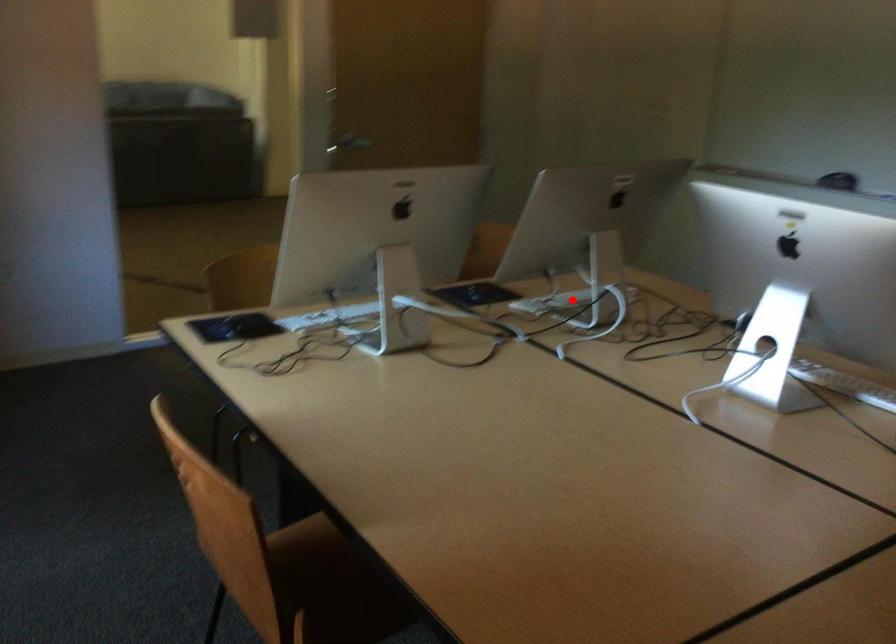
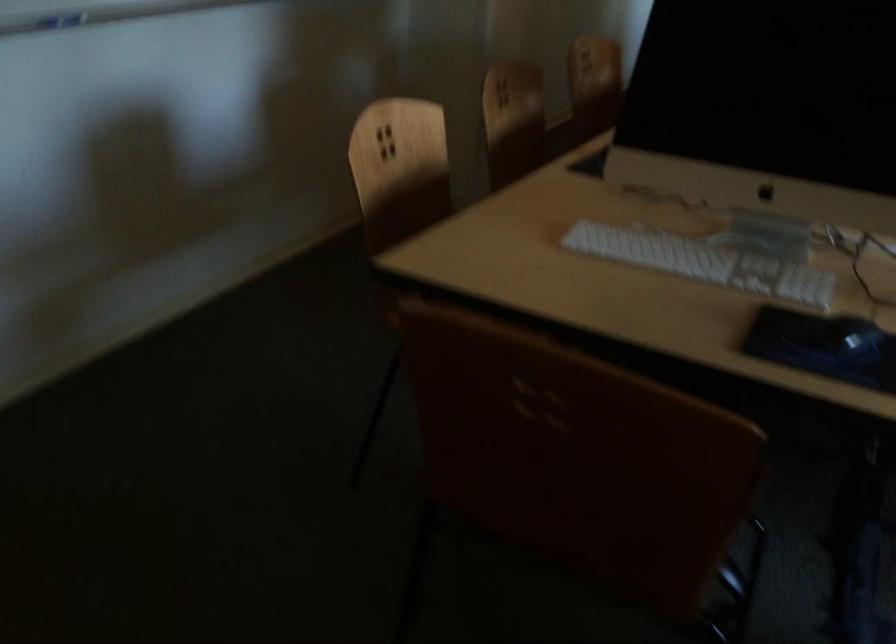
Question: I am providing you with two images of the same scene from different viewpoints. A red point is marked on the first image. At the location where the point appears in image 1, is it still visible in image 2?

Choices:
 (A) Yes
 (B) No

Answer: (A)